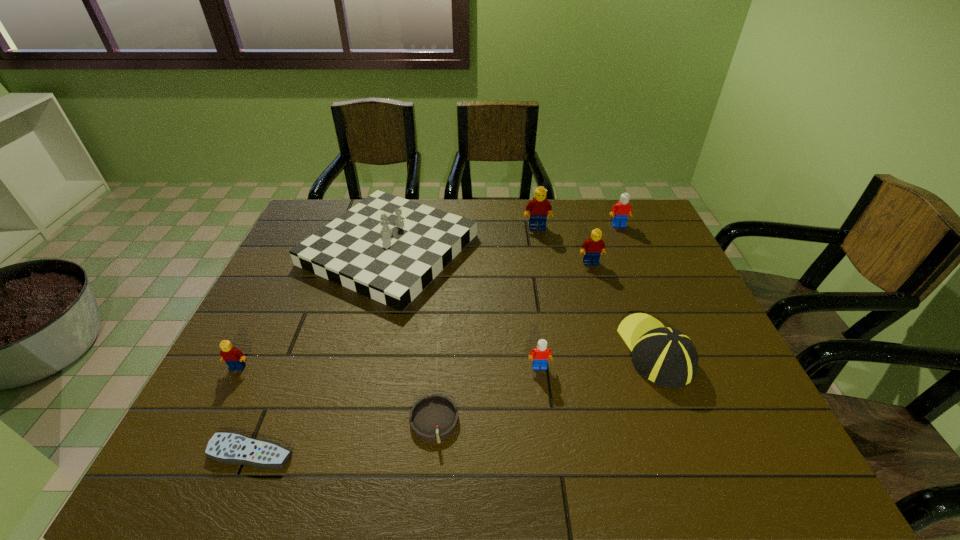
Find the location of `vacant space that's between the smallest yellow Lego and the third nearest Lego`. vacant space that's between the smallest yellow Lego and the third nearest Lego is located at coordinates (414, 315).

This screenshot has height=540, width=960. I want to click on unoccupied position between the smallest yellow Lego and the rightmost yellow Lego, so point(414,315).

In order to click on blank region between the second yellow Lego from right to left and the left white Lego in this screenshot , I will do `click(539, 297)`.

Identify the location of free point between the gray ashtray and the checkerboard. Image resolution: width=960 pixels, height=540 pixels. (412, 336).

Locate an element on the screen. The height and width of the screenshot is (540, 960). free space that is in between the checkerboard and the second nearest yellow Lego is located at coordinates (490, 256).

Locate an element on the screen. This screenshot has height=540, width=960. free space that is in between the ashtray and the remote control is located at coordinates (343, 437).

Identify the location of free space between the black checkerboard and the remote control. (320, 351).

This screenshot has width=960, height=540. Identify the location of vacant point located between the bigger white Lego and the shortest object. (435, 339).

The width and height of the screenshot is (960, 540). I want to click on vacant point located between the right white Lego and the checkerboard, so click(x=504, y=237).

Choose which object is the second nearest neighbor to the second yellow Lego from right to left. Please provide its 2D coordinates. Your answer should be formatted as a tuple, i.e. [(x, y)], where the tuple contains the x and y coordinates of a point satisfying the conditions above.

[(592, 248)]